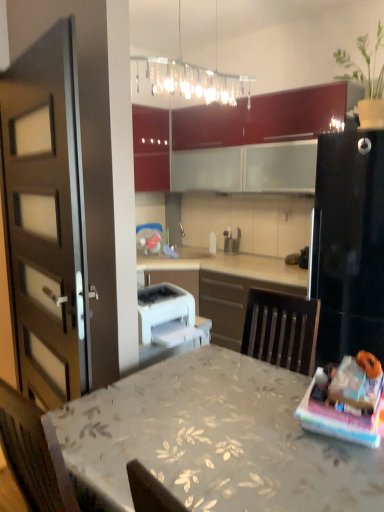
Find the location of a particular element. The image size is (384, 512). free space above floral-patterned fabric table at center (from a real-world perspective) is located at coordinates (201, 424).